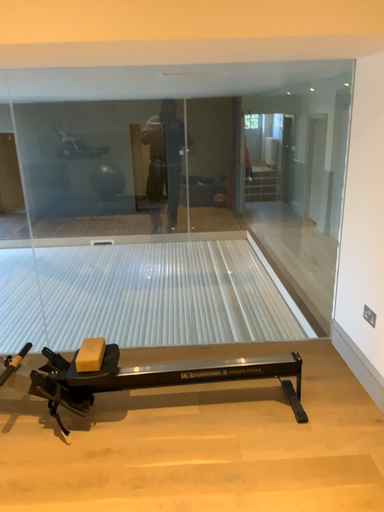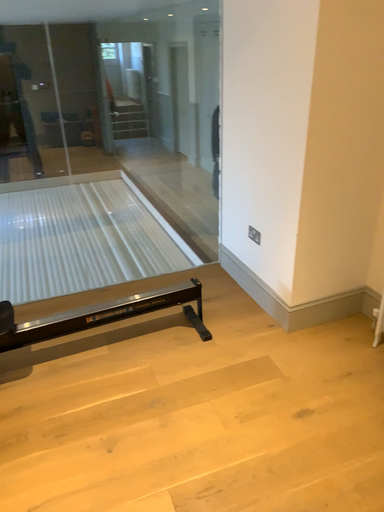
Question: Which way did the camera rotate in the video?

Choices:
 (A) rotated left
 (B) rotated right

Answer: (B)